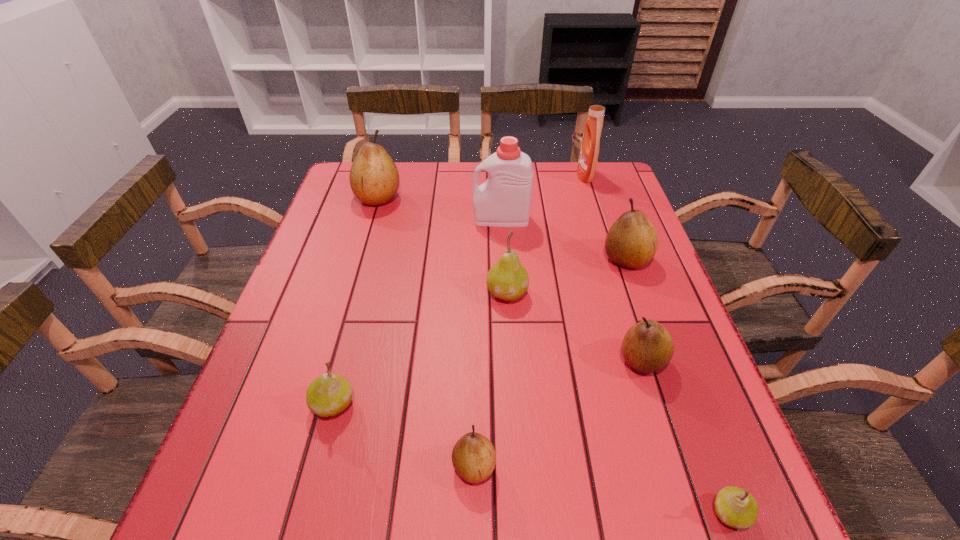
At what (x,y) coordinates should I click in order to perform the action: click on the right detergent. Please return your answer as a coordinate pair (x, y). Looking at the image, I should click on (589, 151).

This screenshot has height=540, width=960. I want to click on the left detergent, so click(x=504, y=200).

Image resolution: width=960 pixels, height=540 pixels. Find the location of `the nearer detergent`. the nearer detergent is located at coordinates (504, 200).

Locate an element on the screen. The image size is (960, 540). the farthest brown pear is located at coordinates (374, 179).

At what (x,y) coordinates should I click in order to perform the action: click on the leftmost brown pear. Please return your answer as a coordinate pair (x, y). Looking at the image, I should click on (374, 179).

Identify the location of the fourth farthest object. Image resolution: width=960 pixels, height=540 pixels. (632, 241).

I want to click on the second farthest pear, so click(632, 241).

Find the location of a particular element. the fifth farthest object is located at coordinates (508, 279).

Identify the location of the third farthest pear. This screenshot has height=540, width=960. (508, 279).

Find the location of a particular element. the third biggest brown pear is located at coordinates click(x=647, y=347).